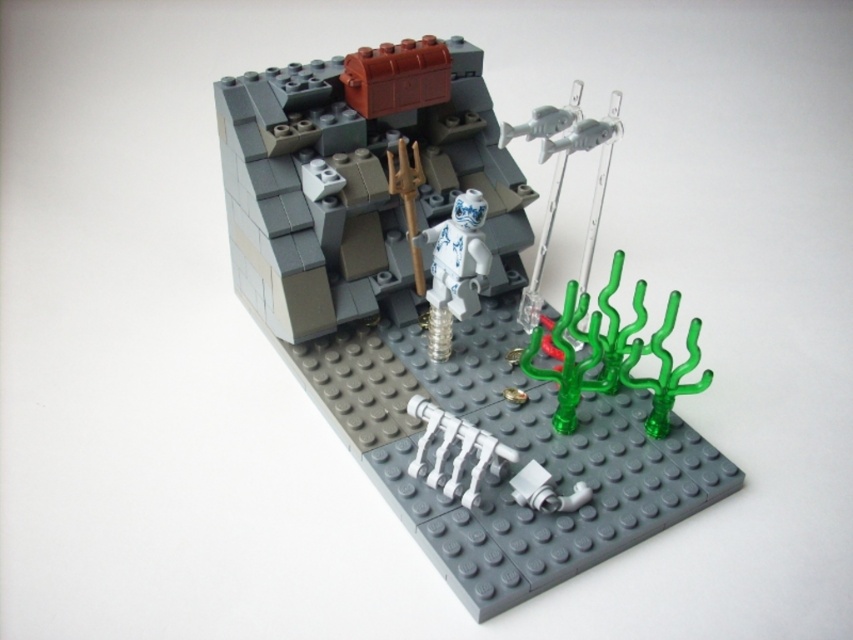
Question: Is white glossy minifigure at center to the right of porcelain figure at center from the viewer's perspective?

Choices:
 (A) yes
 (B) no

Answer: (A)

Question: Which point appears closest to the camera in this image?

Choices:
 (A) (438, 243)
 (B) (419, 321)

Answer: (A)

Question: Which object appears closest to the camera in this image?

Choices:
 (A) porcelain figure at center
 (B) white glossy minifigure at center

Answer: (B)

Question: In this image, where is white glossy minifigure at center located relative to porcelain figure at center?

Choices:
 (A) left
 (B) right

Answer: (B)

Question: Can you confirm if white glossy minifigure at center is positioned below porcelain figure at center?

Choices:
 (A) yes
 (B) no

Answer: (A)